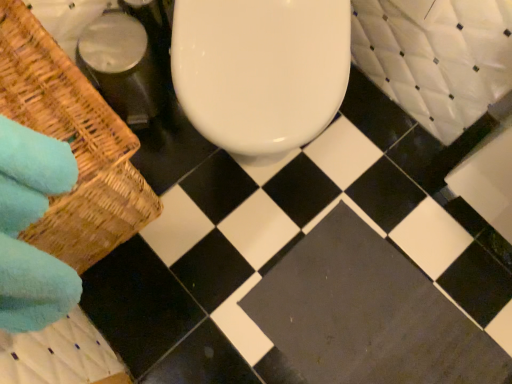
Question: Is point (473, 362) positioned closer to the camera than point (4, 66)?

Choices:
 (A) closer
 (B) farther

Answer: (B)

Question: From the image's perspective, is dark gray concrete at center positioned above or below woven brown basket at left?

Choices:
 (A) below
 (B) above

Answer: (A)

Question: Is dark gray concrete at center wider or thinner than woven brown basket at left?

Choices:
 (A) wide
 (B) thin

Answer: (B)

Question: Is point (113, 160) positioned closer to the camera than point (425, 284)?

Choices:
 (A) farther
 (B) closer

Answer: (B)

Question: Looking at their shapes, would you say woven brown basket at left is wider or thinner than dark gray concrete at center?

Choices:
 (A) thin
 (B) wide

Answer: (B)

Question: Which is correct: woven brown basket at left is inside dark gray concrete at center, or outside of it?

Choices:
 (A) outside
 (B) inside

Answer: (A)

Question: Relative to dark gray concrete at center, is woven brown basket at left in front or behind?

Choices:
 (A) behind
 (B) front

Answer: (B)